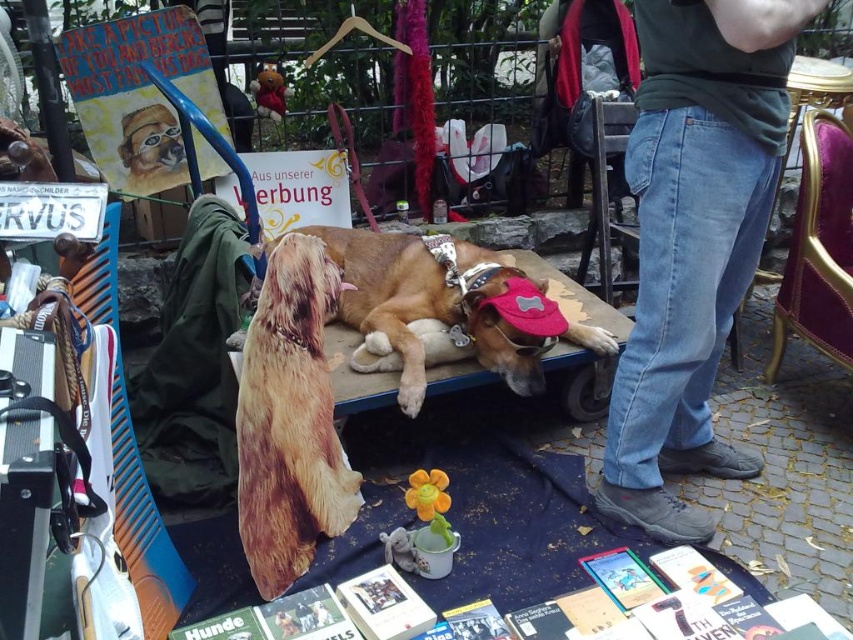
Does jeans at lower right have a greater height compared to brown fur dog at center?

Yes, jeans at lower right is taller than brown fur dog at center.

Does jeans at lower right have a larger size compared to brown fur dog at center?

Yes.

Between point (782, 17) and point (430, 241), which one is positioned in front?

Point (782, 17)

Where is `jeans at lower right`? Image resolution: width=853 pixels, height=640 pixels. jeans at lower right is located at coordinates (693, 240).

Is brown furry dog at center bigger than brown fur dog at center?

No.

Who is more distant from viewer, (283,241) or (460,282)?

Point (460,282)

I want to click on brown furry dog at center, so (289, 419).

Which of these two, jeans at lower right or brown furry dog at center, stands shorter?

brown furry dog at center

Is jeans at lower right to the left of brown furry dog at center from the viewer's perspective?

In fact, jeans at lower right is to the right of brown furry dog at center.

Looking at this image, who is more distant from viewer, (648, 68) or (277, 525)?

Point (648, 68)

Locate an element on the screen. This screenshot has width=853, height=640. jeans at lower right is located at coordinates (693, 240).